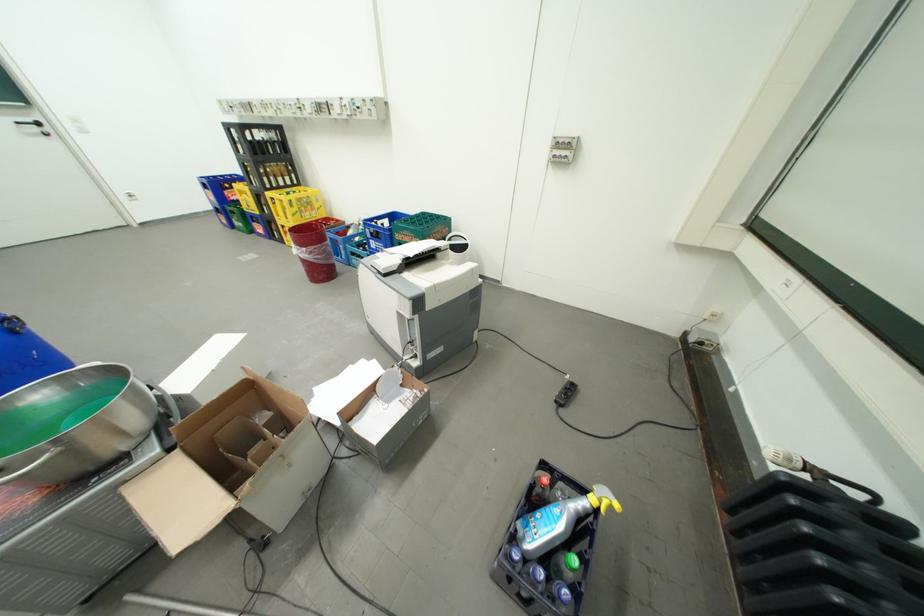
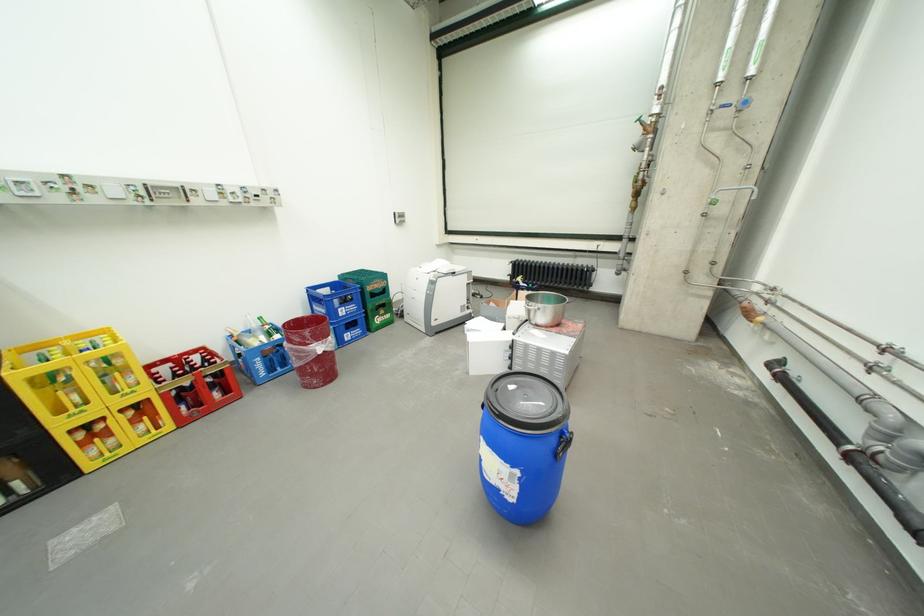
The point at (x=323, y=228) is marked in the first image. Where is the corresponding point in the second image?

(297, 328)